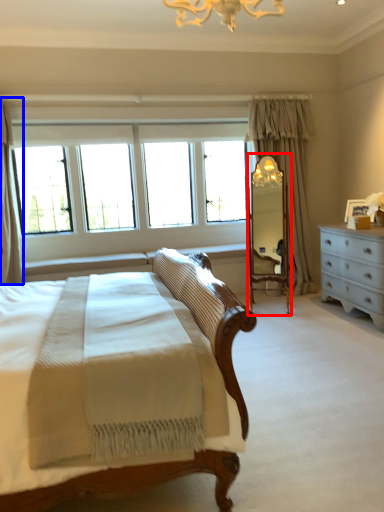
Question: Which object appears farthest to the camera in this image, mirror (highlighted by a red box) or curtain (highlighted by a blue box)?

Choices:
 (A) mirror
 (B) curtain

Answer: (A)